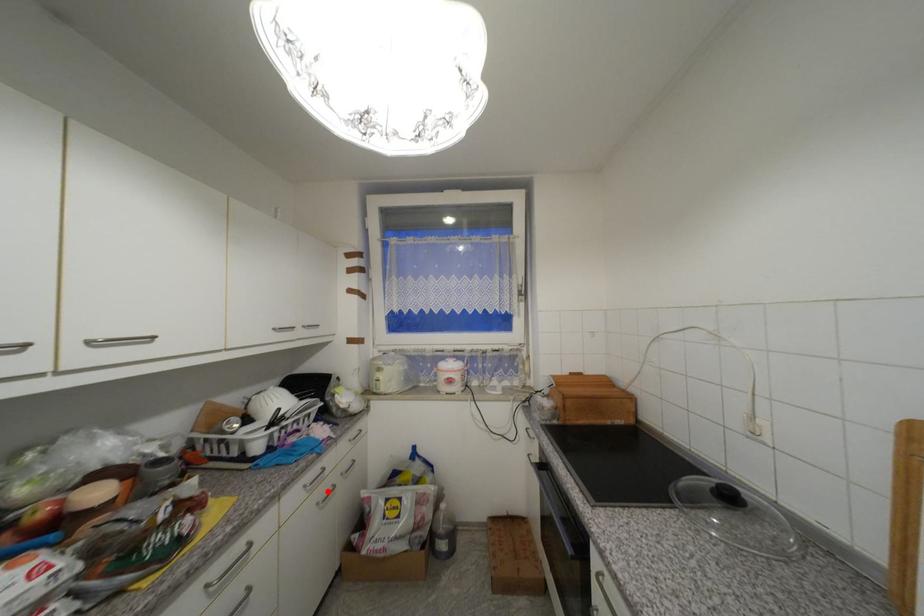
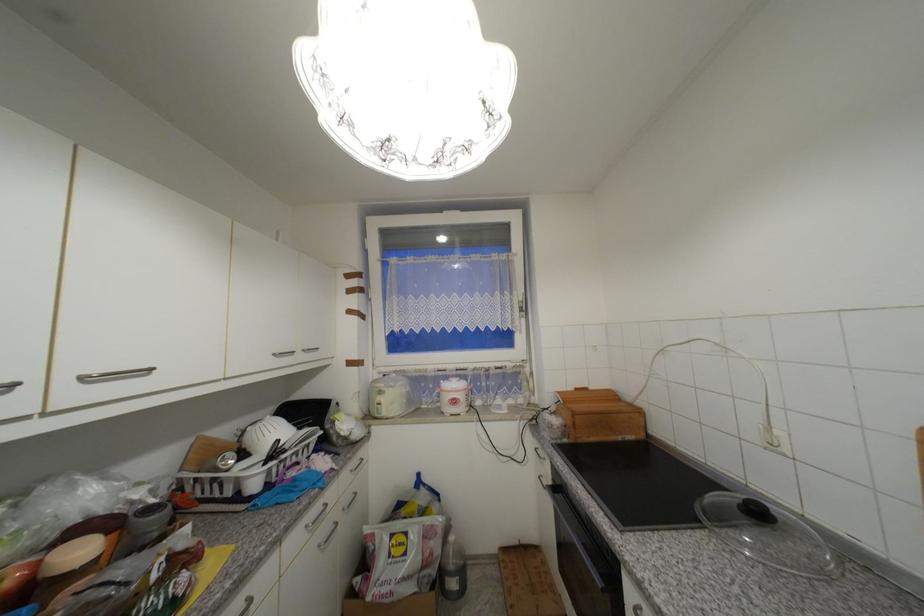
The point at the highlighted location is marked in the first image. Where is the corresponding point in the second image?

(330, 531)